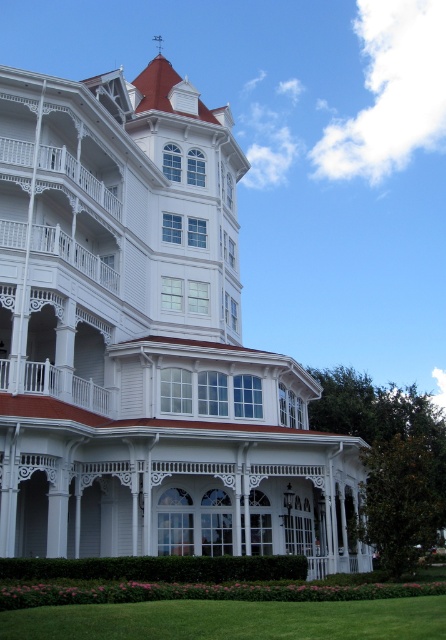
Question: Considering the relative positions of white wood mansion at center and green grass at lower center in the image provided, where is white wood mansion at center located with respect to green grass at lower center?

Choices:
 (A) above
 (B) below

Answer: (A)

Question: Can you confirm if green grass at lower center is wider than white painted wood porch at left?

Choices:
 (A) yes
 (B) no

Answer: (A)

Question: Can you confirm if green grass at lower center is positioned to the left of white painted wood porch at left?

Choices:
 (A) no
 (B) yes

Answer: (A)

Question: Among these points, which one is nearest to the camera?

Choices:
 (A) (355, 621)
 (B) (8, 413)
 (C) (33, 364)

Answer: (A)

Question: Which of the following is the farthest from the observer?

Choices:
 (A) (384, 609)
 (B) (53, 433)
 (C) (93, 408)

Answer: (C)

Question: Among these objects, which one is farthest from the camera?

Choices:
 (A) white wood mansion at center
 (B) white painted wood porch at left

Answer: (B)